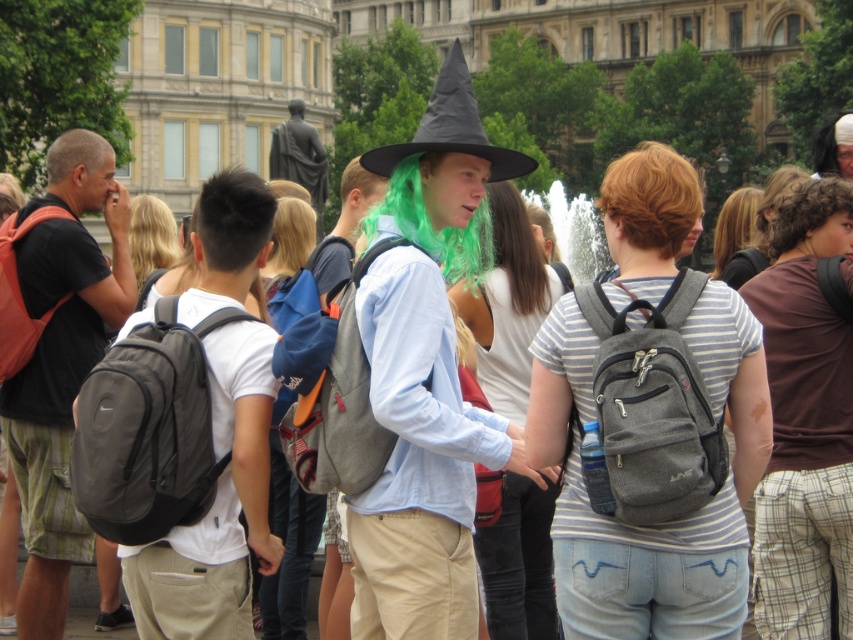
You are a photographer standing at the center of the square with a camera that has a maximum zoom of 5 meters. You want to take a photo of both the blonde curly hair at upper right and the black felt wizard hat at center without moving. Can you capture both subjects in the same frame?

The blonde curly hair at upper right is 10.65 meters from the black felt wizard hat at center. Since the camera can only zoom up to 5 meters, it cannot capture both subjects in the same frame as they are more than 5 meters apart.

You are standing in the public square and want to take a photo of both the point at coordinates (668, 163) and the point at coordinates (424, 131). Which point should you focus on first to ensure both are in focus?

You should focus on the point at coordinates (668, 163) first because it is closer to the camera than the point at coordinates (424, 131). This ensures that both points will be in focus when using depth of field.

In the bustling outdoor gathering near the historic building, you notice two distinctive items in the crowd. There is a person with blonde curly hair at upper right and another wearing a black felt wizard hat at center. From the perspective of someone standing at the center of the scene, which of these two items is positioned to the left?

The black felt wizard hat at center is to the left of the blonde curly hair at upper right from the center perspective.